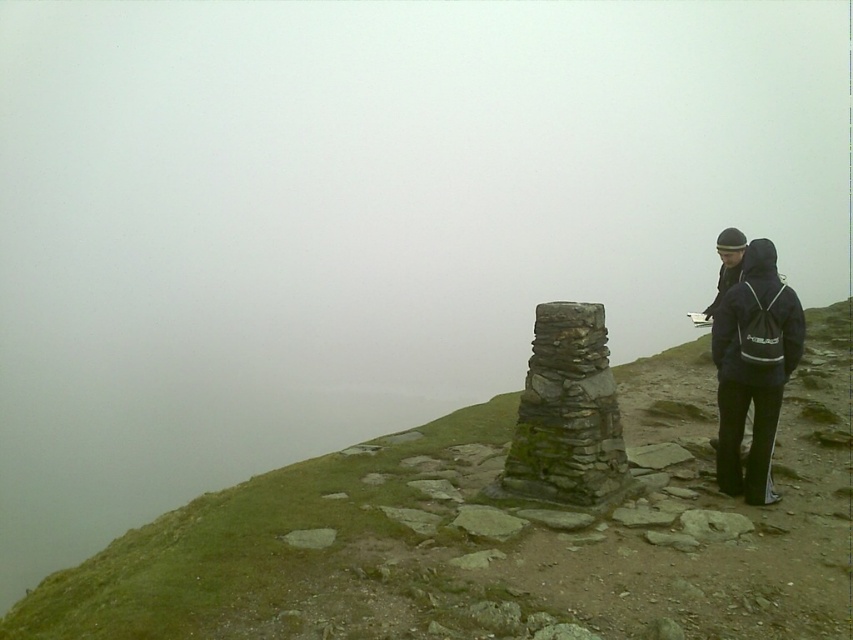
Question: Considering the real-world distances, which object is closest to the green mossy stone stack at center?

Choices:
 (A) dark blue fleece jacket at right
 (B) green mossy stone at center

Answer: (A)

Question: Can you confirm if green mossy stone at center is thinner than dark blue fleece jacket at right?

Choices:
 (A) yes
 (B) no

Answer: (B)

Question: Is green mossy stone at center bigger than green mossy stone stack at center?

Choices:
 (A) yes
 (B) no

Answer: (A)

Question: Does green mossy stone at center have a lesser width compared to dark blue fleece jacket at right?

Choices:
 (A) no
 (B) yes

Answer: (A)

Question: Which is farther from the dark blue fleece jacket at right?

Choices:
 (A) green mossy stone at center
 (B) green mossy stone stack at center

Answer: (A)

Question: Among these objects, which one is farthest from the camera?

Choices:
 (A) green mossy stone stack at center
 (B) green mossy stone at center

Answer: (A)